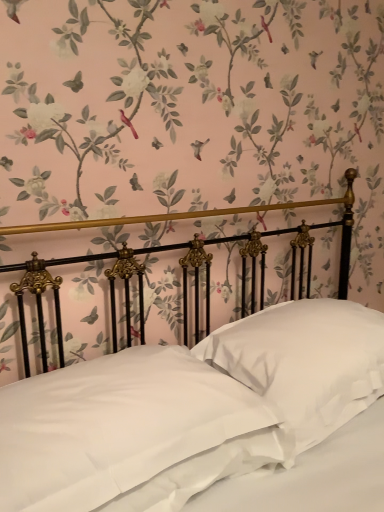
Question: From the image's perspective, is satin white bed at center positioned above or below white satin pillow at center, which is the 1th pillow in right-to-left order?

Choices:
 (A) below
 (B) above

Answer: (B)

Question: Is satin white bed at center taller or shorter than white satin pillow at center, which is the 1th pillow in right-to-left order?

Choices:
 (A) short
 (B) tall

Answer: (B)

Question: Based on their relative distances, which object is farther from the white satin pillow at center, which ranks as the 2th pillow in right-to-left order?

Choices:
 (A) white satin pillow at center, the second pillow when ordered from left to right
 (B) satin white bed at center

Answer: (A)

Question: Based on their relative distances, which object is farther from the white satin pillow at center, which appears as the first pillow when viewed from the left?

Choices:
 (A) white satin pillow at center, the second pillow when ordered from left to right
 (B) satin white bed at center

Answer: (A)